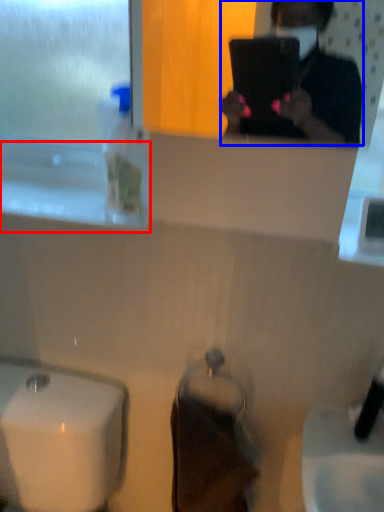
Question: Which of the following is the farthest to the observer, window sill (highlighted by a red box) or person (highlighted by a blue box)?

Choices:
 (A) window sill
 (B) person

Answer: (A)